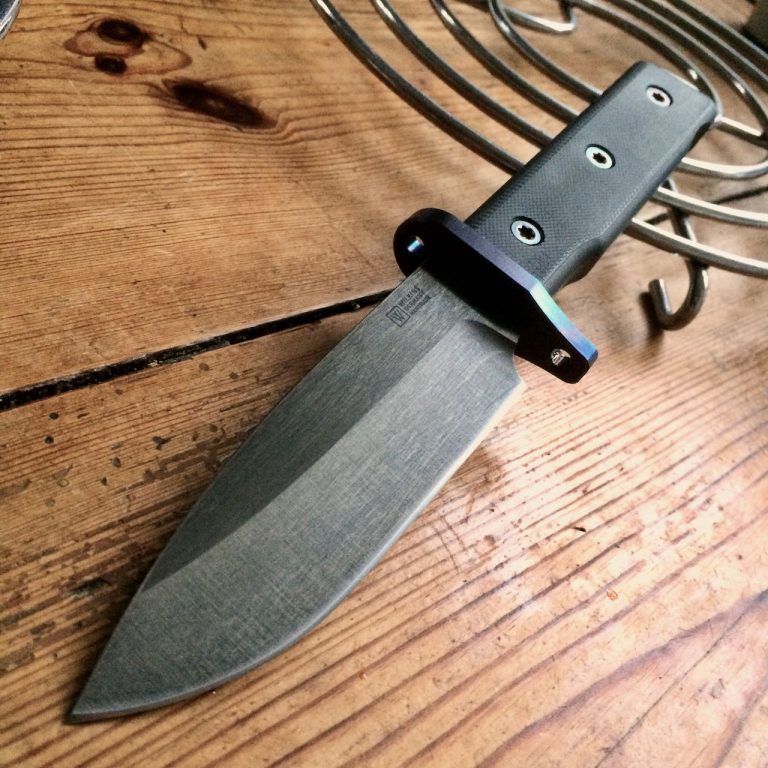
Find the location of `edge between wood slabs`. edge between wood slabs is located at coordinates (166, 358), (343, 309), (743, 193).